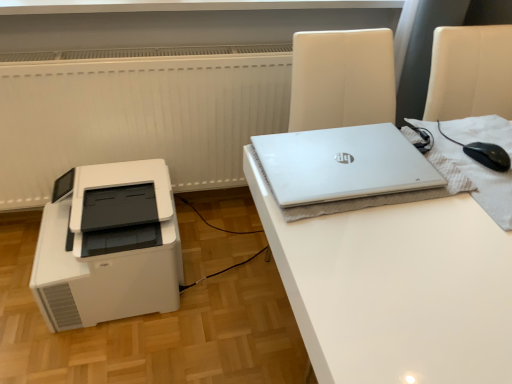
Question: Choose the correct answer: Is white plastic printer at lower left inside silver metallic laptop at upper right or outside it?

Choices:
 (A) inside
 (B) outside

Answer: (B)

Question: From a real-world perspective, is white plastic printer at lower left above or below silver metallic laptop at upper right?

Choices:
 (A) above
 (B) below

Answer: (B)

Question: Which object is positioned closest to the black matte mouse at right?

Choices:
 (A) white plastic printer at lower left
 (B) white glossy desk at upper right
 (C) silver metallic laptop at upper right

Answer: (C)

Question: Estimate the real-world distances between objects in this image. Which object is closer to the black matte mouse at right?

Choices:
 (A) silver metallic laptop at upper right
 (B) white glossy desk at upper right
 (C) white plastic printer at lower left

Answer: (A)